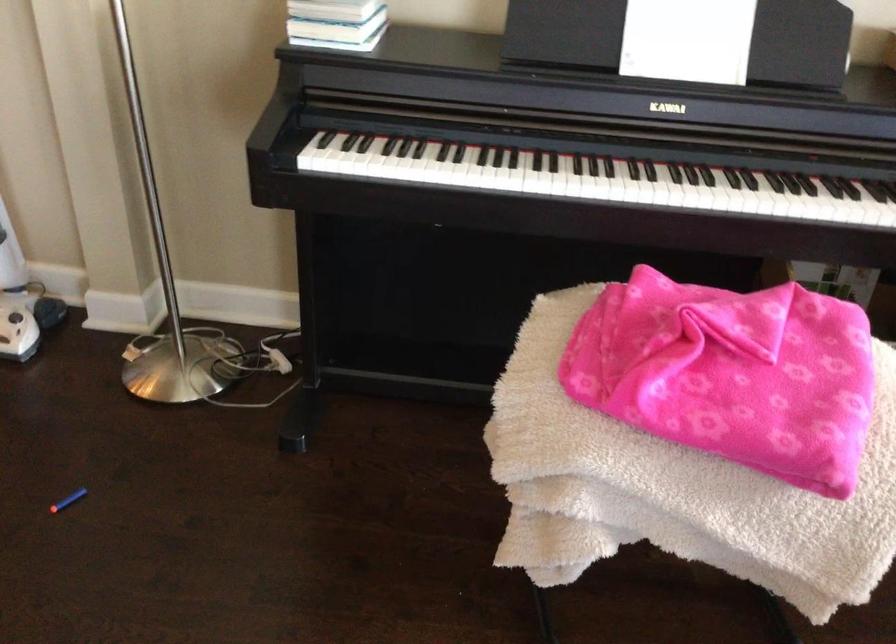
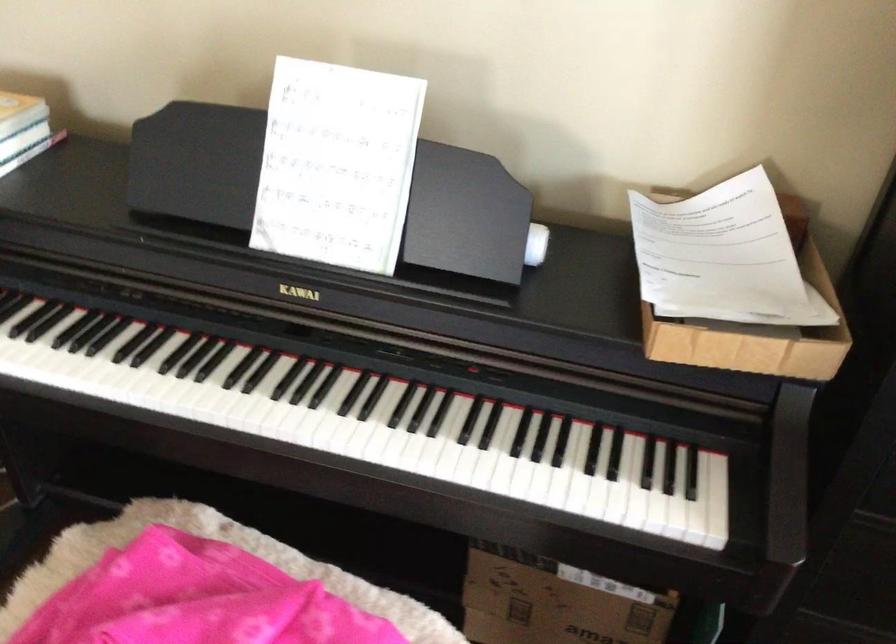
Where in the second image is the point corresponding to (665,182) from the first image?

(245, 412)